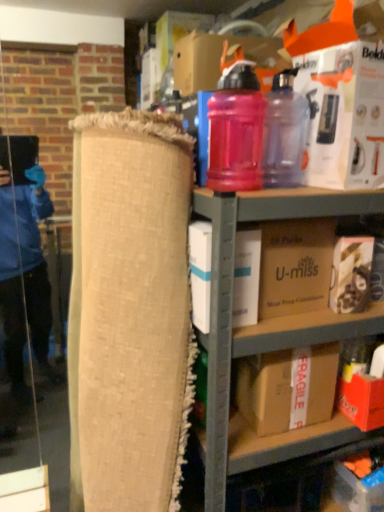
Question: Does pink translucent bottle at upper center, placed as the second bottle when sorted from right to left, lie behind brown cardboard box at center, which ranks as the 2th box in top-to-bottom order?

Choices:
 (A) no
 (B) yes

Answer: (A)

Question: Is pink translucent bottle at upper center, placed as the second bottle when sorted from right to left, placed right next to brown cardboard box at center, which ranks as the 2th box in top-to-bottom order?

Choices:
 (A) no
 (B) yes

Answer: (A)

Question: Does pink translucent bottle at upper center, which appears as the first bottle when viewed from the left, have a lesser height compared to brown cardboard box at center, which ranks as the 2th box in top-to-bottom order?

Choices:
 (A) yes
 (B) no

Answer: (B)

Question: Is there a large distance between pink translucent bottle at upper center, which appears as the first bottle when viewed from the left, and brown cardboard box at center, which ranks as the 2th box in top-to-bottom order?

Choices:
 (A) no
 (B) yes

Answer: (A)

Question: Could you tell me if pink translucent bottle at upper center, placed as the second bottle when sorted from right to left, is facing brown cardboard box at center, which ranks as the 2th box in top-to-bottom order?

Choices:
 (A) yes
 (B) no

Answer: (B)

Question: From a real-world perspective, is white cardboard box at upper right, acting as the first box starting from the top, positioned above or below matte brown box at lower right, acting as the third box starting from the top?

Choices:
 (A) below
 (B) above

Answer: (B)

Question: Considering the positions of white cardboard box at upper right, the 5th box from the bottom, and matte brown box at lower right, acting as the third box starting from the top, in the image, is white cardboard box at upper right, the 5th box from the bottom, wider or thinner than matte brown box at lower right, acting as the third box starting from the top,?

Choices:
 (A) thin
 (B) wide

Answer: (B)

Question: Considering their positions, is white cardboard box at upper right, the 5th box from the bottom, located in front of or behind matte brown box at lower right, which is the third box from bottom to top?

Choices:
 (A) behind
 (B) front

Answer: (B)

Question: Based on their positions, is white cardboard box at upper right, acting as the first box starting from the top, located to the left or right of matte brown box at lower right, which is the third box from bottom to top?

Choices:
 (A) right
 (B) left

Answer: (B)

Question: From the image's perspective, is white cardboard box at upper right, the 5th box from the bottom, located above or below matte plastic shelf at upper center?

Choices:
 (A) below
 (B) above

Answer: (B)

Question: In terms of height, does white cardboard box at upper right, acting as the first box starting from the top, look taller or shorter compared to matte plastic shelf at upper center?

Choices:
 (A) short
 (B) tall

Answer: (A)

Question: From a real-world perspective, is white cardboard box at upper right, acting as the first box starting from the top, physically located above or below matte plastic shelf at upper center?

Choices:
 (A) above
 (B) below

Answer: (A)

Question: Considering the positions of white cardboard box at upper right, the 5th box from the bottom, and matte plastic shelf at upper center in the image, is white cardboard box at upper right, the 5th box from the bottom, bigger or smaller than matte plastic shelf at upper center?

Choices:
 (A) big
 (B) small

Answer: (B)

Question: From the image's perspective, relative to white cardboard box at center, acting as the second box starting from the bottom, is fragile cardboard box at lower right above or below?

Choices:
 (A) above
 (B) below

Answer: (B)

Question: In terms of height, does fragile cardboard box at lower right look taller or shorter compared to white cardboard box at center, acting as the second box starting from the bottom?

Choices:
 (A) tall
 (B) short

Answer: (B)